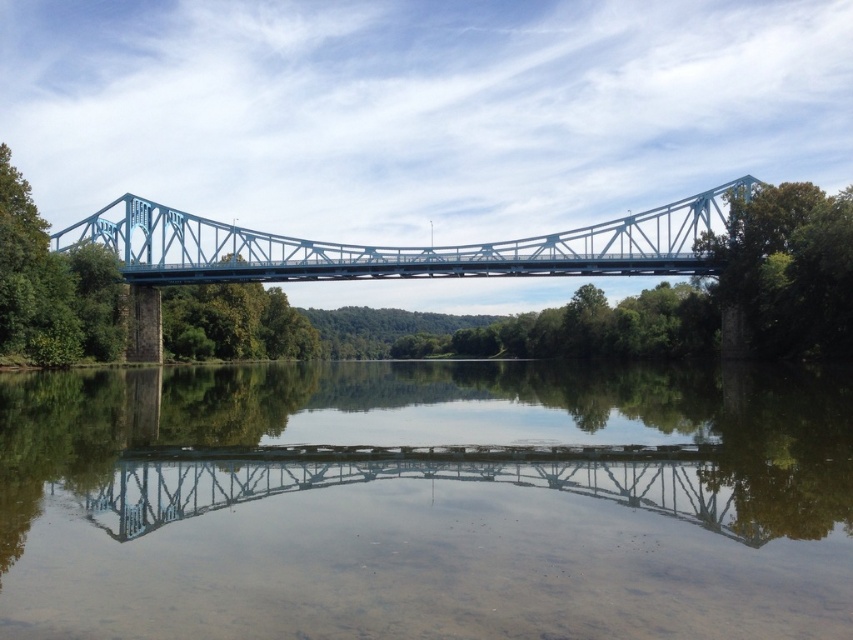
What do you see at coordinates (424, 502) in the screenshot? I see `clear water at center` at bounding box center [424, 502].

Which is more to the right, clear water at center or blue metallic bridge at center?

clear water at center is more to the right.

Is point (628, 525) in front of point (746, 182)?

Yes, point (628, 525) is closer to viewer.

Where is `clear water at center`? Image resolution: width=853 pixels, height=640 pixels. clear water at center is located at coordinates (424, 502).

Can you confirm if clear water at center is positioned below green leafy tree at upper right?

Yes, clear water at center is below green leafy tree at upper right.

Is clear water at center positioned before green leafy tree at upper right?

Yes, it is in front of green leafy tree at upper right.

Locate an element on the screen. This screenshot has width=853, height=640. clear water at center is located at coordinates (424, 502).

Can you confirm if blue metallic bridge at center is shorter than green leafy tree at upper right?

Yes, blue metallic bridge at center is shorter than green leafy tree at upper right.

The height and width of the screenshot is (640, 853). What are the coordinates of `blue metallic bridge at center` in the screenshot? It's located at (401, 246).

Does point (241, 250) come farther from viewer compared to point (792, 225)?

Yes, it is.

At what (x,y) coordinates should I click in order to perform the action: click on blue metallic bridge at center. Please return your answer as a coordinate pair (x, y). The height and width of the screenshot is (640, 853). Looking at the image, I should click on (401, 246).